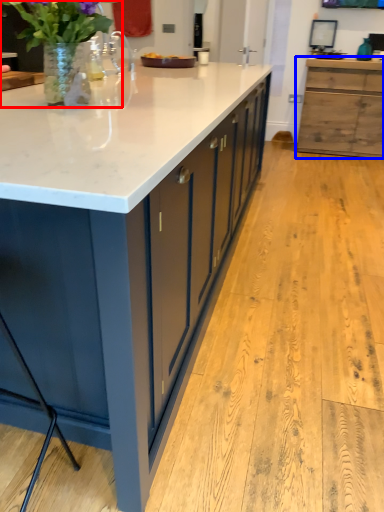
Question: Which point is further to the camera, houseplant (highlighted by a red box) or cabinetry (highlighted by a blue box)?

Choices:
 (A) houseplant
 (B) cabinetry

Answer: (B)